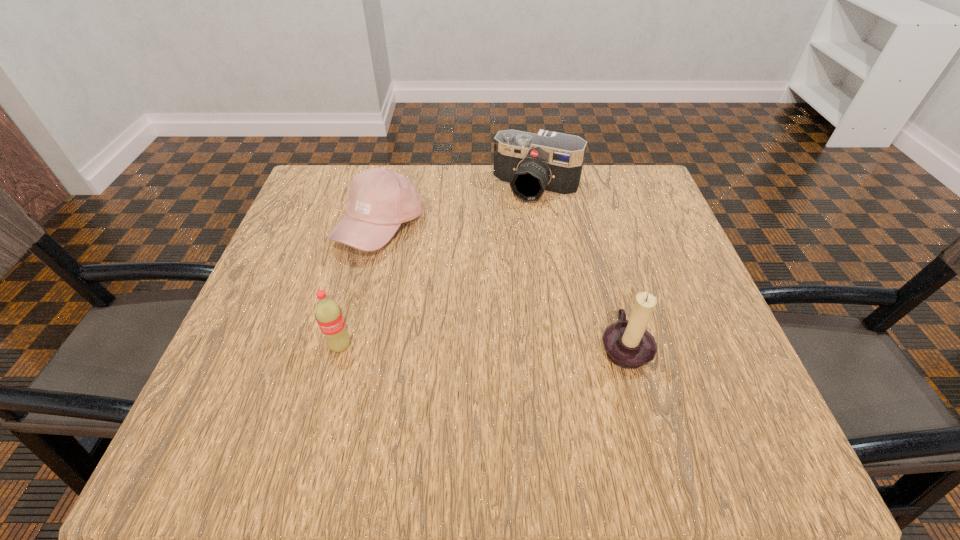
Image resolution: width=960 pixels, height=540 pixels. I want to click on vacant space that is in between the soda and the camera, so click(x=438, y=267).

Find the location of a particular element. vacant space that is in between the camera and the soda is located at coordinates (438, 267).

Locate an element on the screen. The image size is (960, 540). empty space that is in between the camera and the candle holder is located at coordinates (580, 267).

Identify the location of free point between the candle holder and the camera. pyautogui.click(x=580, y=267).

I want to click on unoccupied position between the soda and the baseball cap, so click(x=360, y=287).

You are a GUI agent. You are given a task and a screenshot of the screen. Output one action in this format:
    pyautogui.click(x=<x>, y=<y>)
    Task: Click on the vacant area that lies between the baseball cap and the soda
    The width and height of the screenshot is (960, 540).
    Given the screenshot: What is the action you would take?
    pyautogui.click(x=360, y=287)

The image size is (960, 540). I want to click on object that stands as the closest to the camera, so click(x=380, y=199).

Choose which object is the second nearest neighbor to the baseball cap. Please provide its 2D coordinates. Your answer should be formatted as a tuple, i.e. [(x, y)], where the tuple contains the x and y coordinates of a point satisfying the conditions above.

[(328, 314)]

This screenshot has height=540, width=960. What are the coordinates of `blank space that satisfies the following two spatial constraints: 1. on the front side of the baseball cap; 2. on the wick of the candle holder` in the screenshot? It's located at (351, 346).

Locate an element on the screen. Image resolution: width=960 pixels, height=540 pixels. vacant space that satisfies the following two spatial constraints: 1. on the back side of the soda; 2. on the wick of the candle holder is located at coordinates (341, 346).